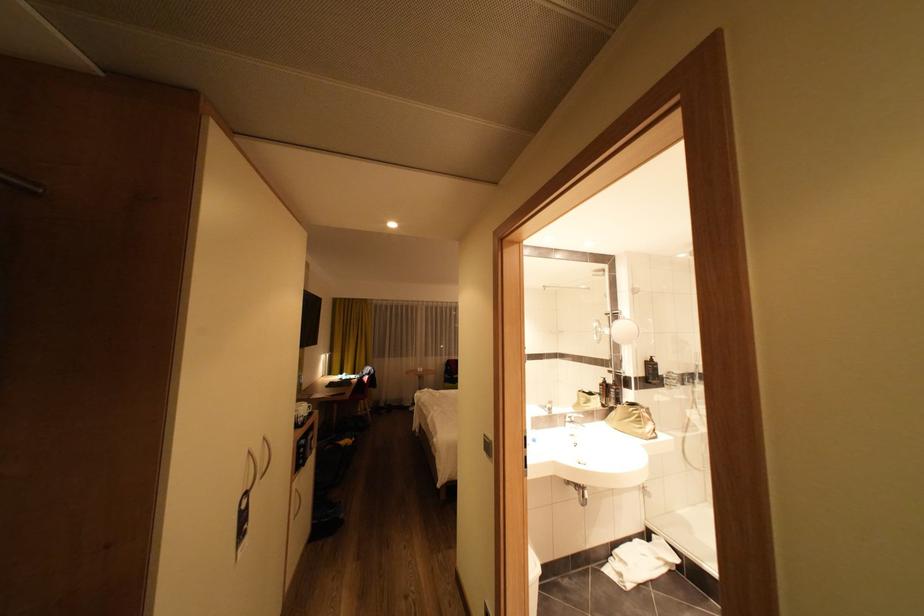
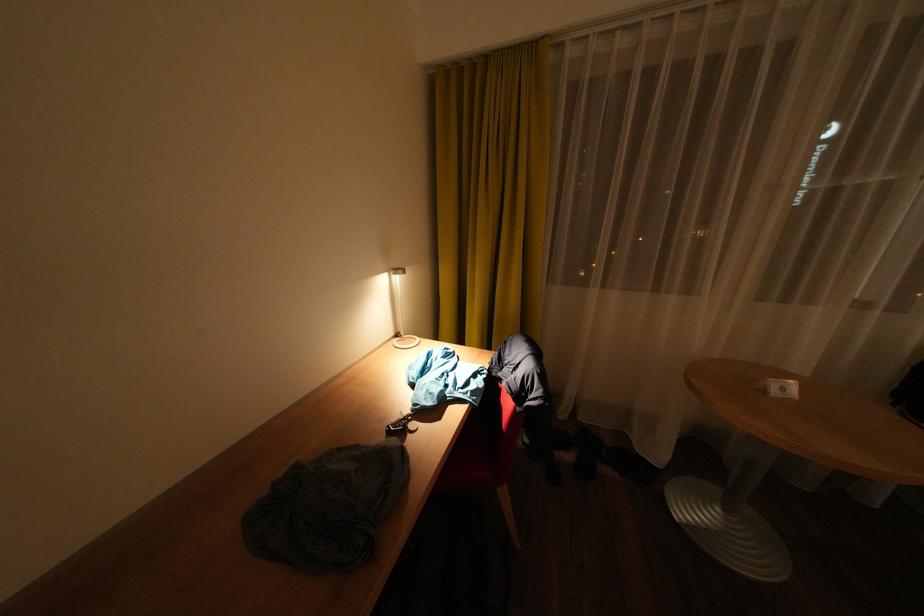
Where in the second image is the point corresponding to point (431, 370) from the first image?

(794, 390)